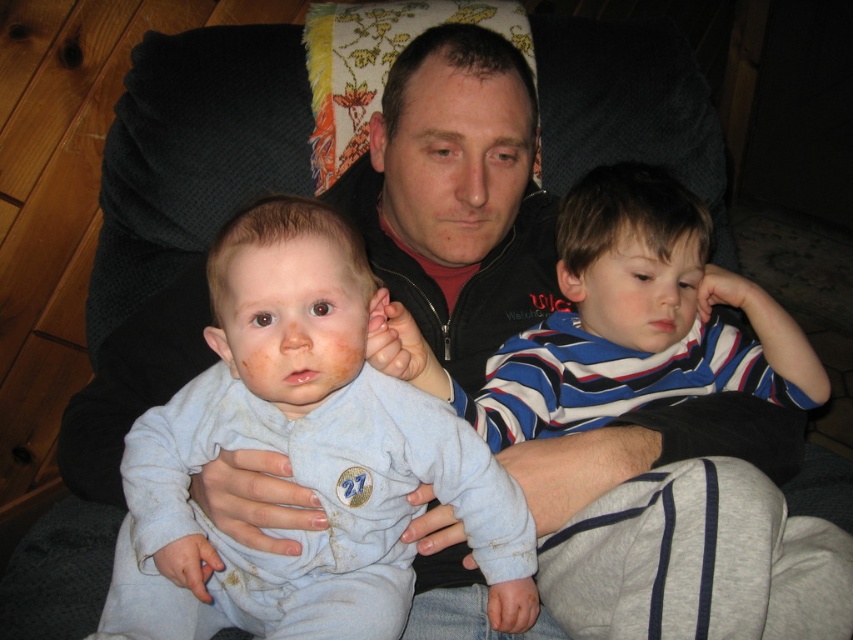
Is striped cotton shirt at center shorter than light blue soft fabric baby at center?

In fact, striped cotton shirt at center may be taller than light blue soft fabric baby at center.

Does point (711, 266) lie in front of point (334, 250)?

No, it is not.

Identify the location of striped cotton shirt at center. The width and height of the screenshot is (853, 640). (619, 323).